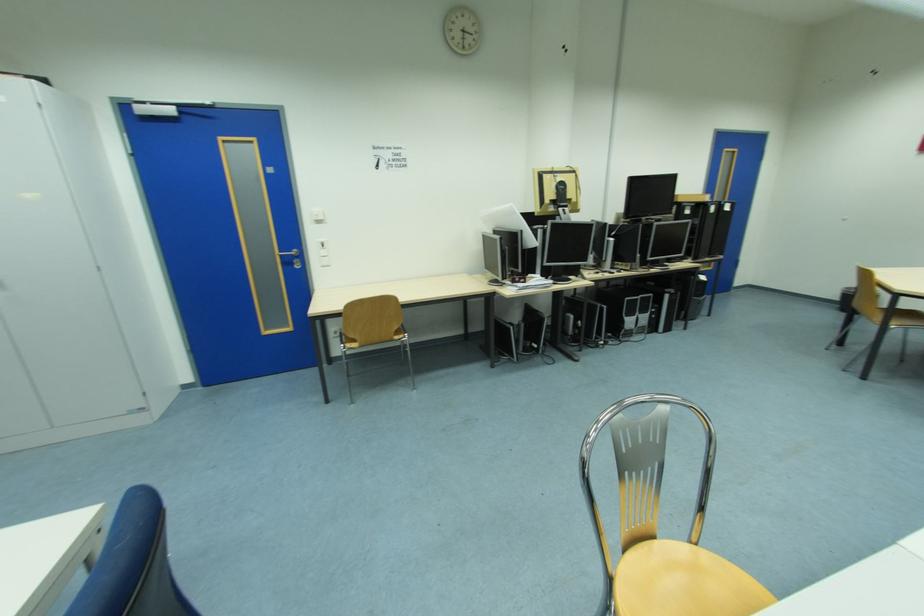
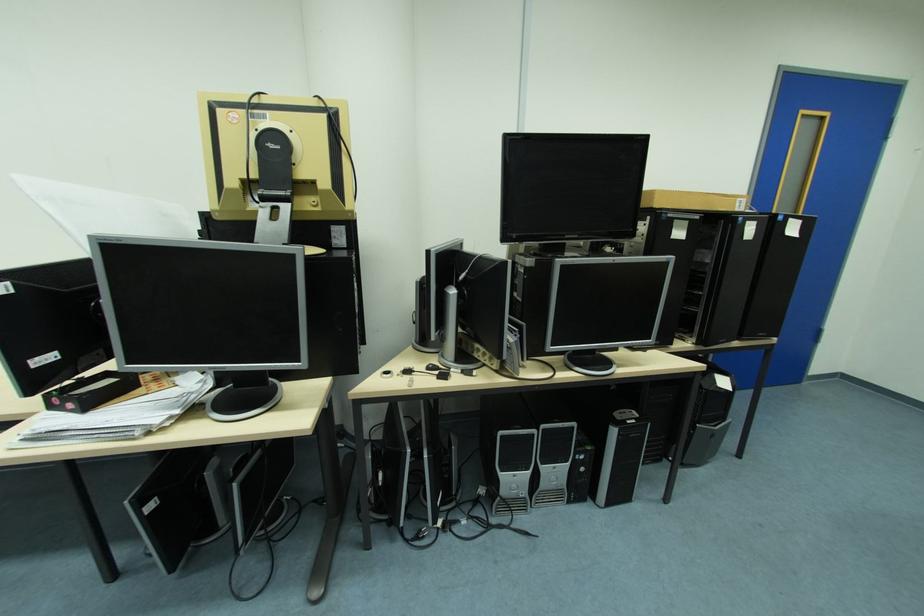
In the second image, find the point that corresponds to [661,317] in the first image.

(590, 469)